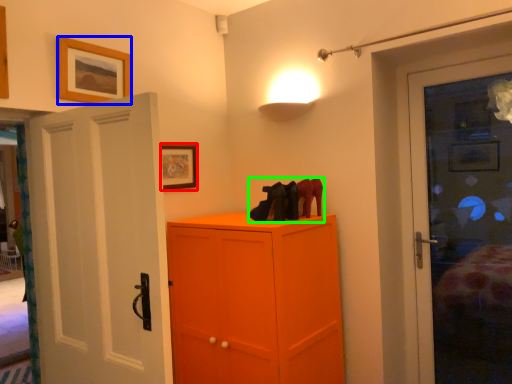
Question: Which is nearer to the picture frame (highlighted by a red box)? picture frame (highlighted by a blue box) or footwear (highlighted by a green box).

Choices:
 (A) picture frame
 (B) footwear

Answer: (A)